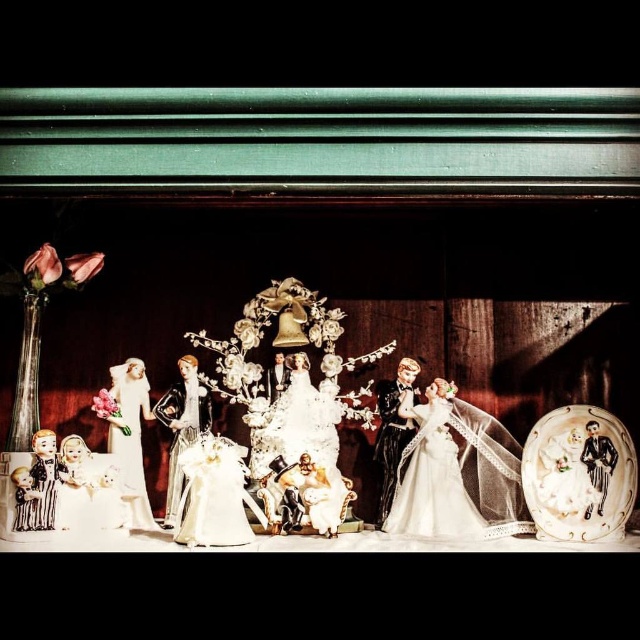
Question: Can you confirm if matte white dress at center is positioned above white porcelain bride at left?

Choices:
 (A) no
 (B) yes

Answer: (A)

Question: Which object appears closest to the camera in this image?

Choices:
 (A) matte white dress at center
 (B) white porcelain bride at left

Answer: (A)

Question: Which point appears farthest from the camera in this image?

Choices:
 (A) (132, 504)
 (B) (396, 500)

Answer: (B)

Question: Is matte white dress at center to the right of white porcelain bride at left from the viewer's perspective?

Choices:
 (A) yes
 (B) no

Answer: (A)

Question: Which of the following is the farthest from the observer?

Choices:
 (A) (456, 524)
 (B) (148, 406)

Answer: (B)

Question: Is matte white dress at center wider than white porcelain bride at left?

Choices:
 (A) yes
 (B) no

Answer: (A)